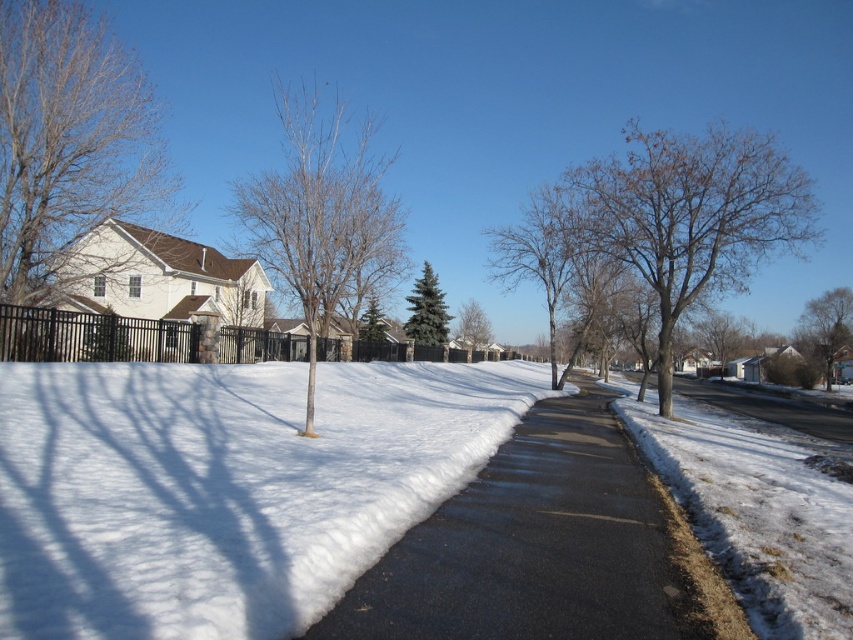
Is point (316, 628) behind point (364, 140)?

No, it is not.

Is point (578, 467) behind point (340, 243)?

That is False.

Locate an element on the screen. Image resolution: width=853 pixels, height=640 pixels. black asphalt sidewalk at center is located at coordinates (532, 545).

Does point (358, 513) come in front of point (554, 289)?

Yes, point (358, 513) is closer to viewer.

Does white fluffy snow at center appear on the left side of bare branches at center?

Yes, white fluffy snow at center is to the left of bare branches at center.

Is point (1, 577) closer to viewer compared to point (566, 209)?

Yes, it is in front of point (566, 209).

Where is `white fluffy snow at center`? This screenshot has height=640, width=853. white fluffy snow at center is located at coordinates (225, 486).

Looking at this image, who is higher up, brown leafy tree at upper right or green textured evergreen tree at center?

brown leafy tree at upper right

I want to click on brown leafy tree at upper right, so click(x=693, y=216).

The image size is (853, 640). Identify the location of brown leafy tree at upper right. (693, 216).